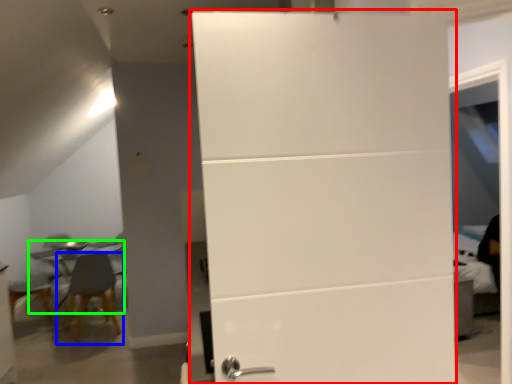
Question: Which object is the farthest from door (highlighted by a red box)? Choose among these: chair (highlighted by a blue box) or table (highlighted by a green box).

Choices:
 (A) chair
 (B) table

Answer: (B)